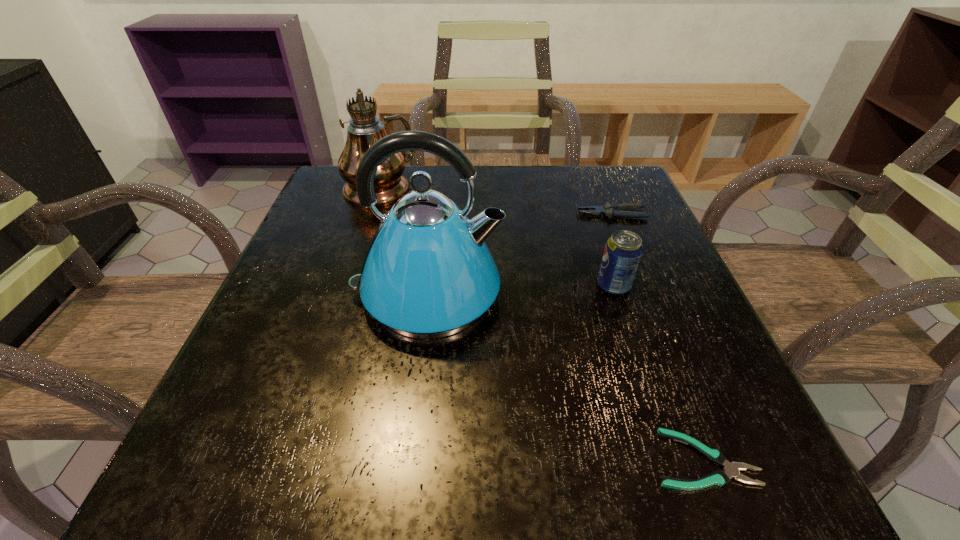
The height and width of the screenshot is (540, 960). What are the coordinates of `object positioned at the far left corner` in the screenshot? It's located at (356, 81).

This screenshot has height=540, width=960. Identify the location of object at the far right corner. (610, 210).

This screenshot has height=540, width=960. I want to click on object that is at the near right corner, so click(731, 470).

Locate an element on the screen. vacant space at the far edge of the desktop is located at coordinates (487, 181).

In the image, there is a desktop. Identify the location of free space at the near edge. The width and height of the screenshot is (960, 540). (544, 465).

In order to click on vacant space at the left edge of the desktop in this screenshot , I will do `click(201, 420)`.

Identify the location of free spot at the right edge of the desktop. This screenshot has width=960, height=540. (690, 316).

Image resolution: width=960 pixels, height=540 pixels. What are the coordinates of `vacant space at the far left corner` in the screenshot? It's located at (333, 183).

Find the location of `vacant space at the near right corner`. vacant space at the near right corner is located at coordinates (759, 450).

Where is `free space between the kettle and the soda`? free space between the kettle and the soda is located at coordinates (520, 290).